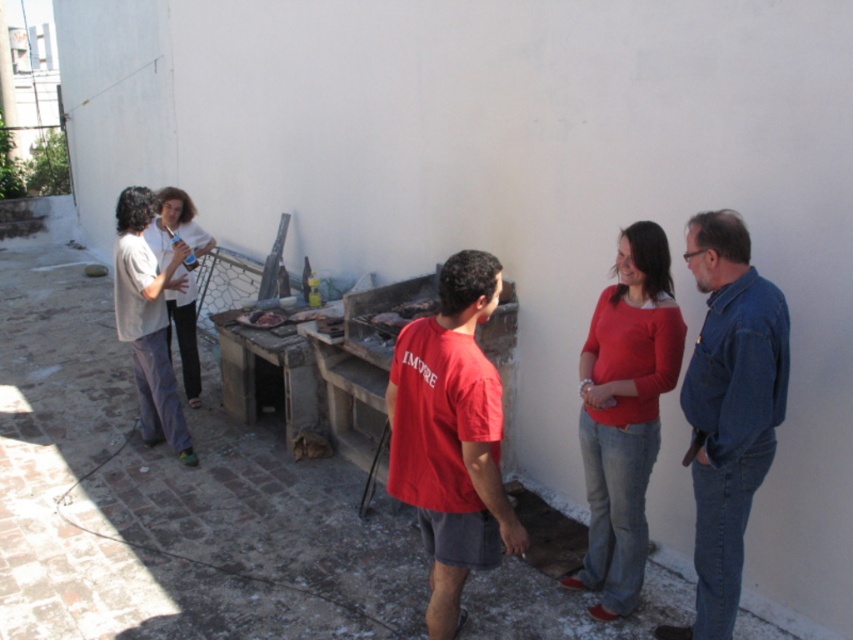
Question: Which of the following is the closest to the observer?

Choices:
 (A) light beige cotton shirt at left
 (B) matte red sweater at center

Answer: (B)

Question: Does red matte shirt at center appear on the left side of white matte shirt at left?

Choices:
 (A) no
 (B) yes

Answer: (A)

Question: Which object appears farthest from the camera in this image?

Choices:
 (A) blue denim shirt at right
 (B) brown leather food at center

Answer: (B)

Question: Is white matte shirt at left below brown leather food at center?

Choices:
 (A) no
 (B) yes

Answer: (A)

Question: Does matte red sweater at center have a greater width compared to light beige cotton shirt at left?

Choices:
 (A) yes
 (B) no

Answer: (B)

Question: Which object is the closest to the white matte shirt at left?

Choices:
 (A) light beige cotton shirt at left
 (B) matte red sweater at center
 (C) blue denim shirt at right

Answer: (A)